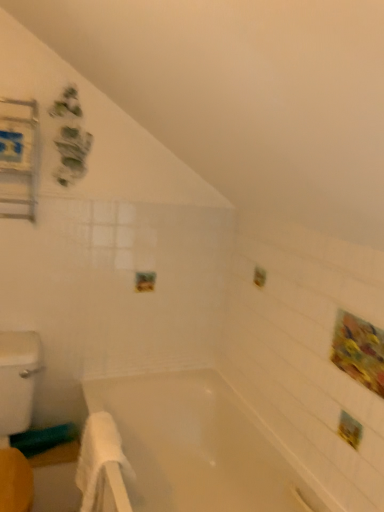
Question: In the image, is metallic silver medicine cabinet at upper left on the left side or the right side of white soft towel at lower left?

Choices:
 (A) right
 (B) left

Answer: (B)

Question: Based on their sizes in the image, would you say metallic silver medicine cabinet at upper left is bigger or smaller than white soft towel at lower left?

Choices:
 (A) small
 (B) big

Answer: (A)

Question: Estimate the real-world distances between objects in this image. Which object is farther from the metallic silver medicine cabinet at upper left?

Choices:
 (A) white glossy bathtub at center
 (B) white soft towel at lower left

Answer: (A)

Question: Based on their relative distances, which object is nearer to the metallic silver medicine cabinet at upper left?

Choices:
 (A) white soft towel at lower left
 (B) white glossy bathtub at center

Answer: (A)